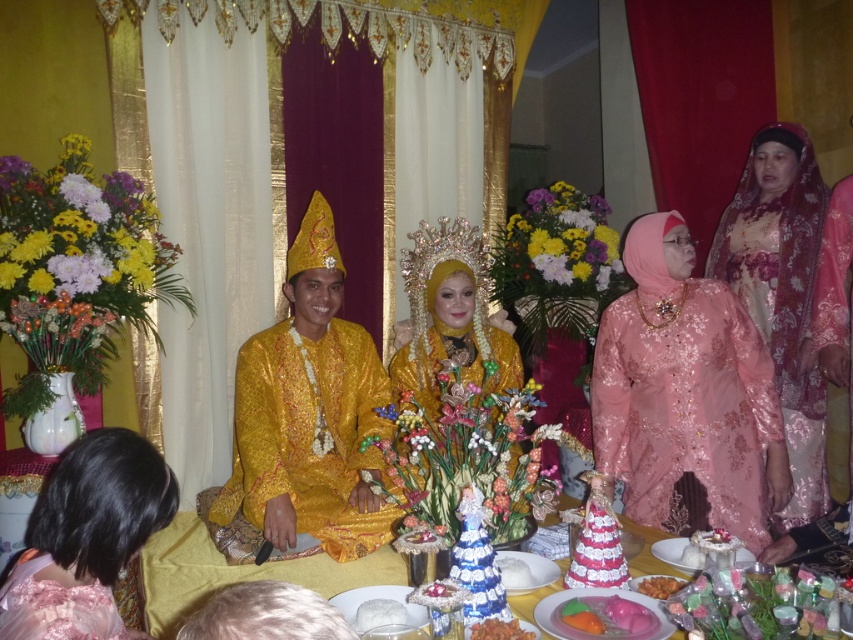
Is shiny gold robe at center positioned in front of pink glossy candy at center?

No.

Describe the element at coordinates (309, 413) in the screenshot. I see `shiny gold robe at center` at that location.

Who is more forward, [242,392] or [639,604]?

Point [639,604] is in front.

Where is `shiny gold robe at center`? Image resolution: width=853 pixels, height=640 pixels. shiny gold robe at center is located at coordinates (309, 413).

Does black satin dress at lower left have a greater width compared to smooth brown rice at lower center?

Indeed, black satin dress at lower left has a greater width compared to smooth brown rice at lower center.

Which is in front, point (71, 448) or point (498, 620)?

Point (71, 448) is in front.

You are a GUI agent. You are given a task and a screenshot of the screen. Output one action in this format:
    pyautogui.click(x=<x>, y=<y>)
    Task: Click on the black satin dress at lower left
    The width and height of the screenshot is (853, 640).
    Given the screenshot: What is the action you would take?
    pyautogui.click(x=86, y=538)

Does pink satin dress at right lie behind pink satin dress at lower left?

Yes.

Does pink satin dress at right have a lesser width compared to pink satin dress at lower left?

In fact, pink satin dress at right might be wider than pink satin dress at lower left.

This screenshot has width=853, height=640. What do you see at coordinates (781, 292) in the screenshot?
I see `pink satin dress at right` at bounding box center [781, 292].

Locate an element on the screen. This screenshot has width=853, height=640. pink satin dress at right is located at coordinates pyautogui.click(x=781, y=292).